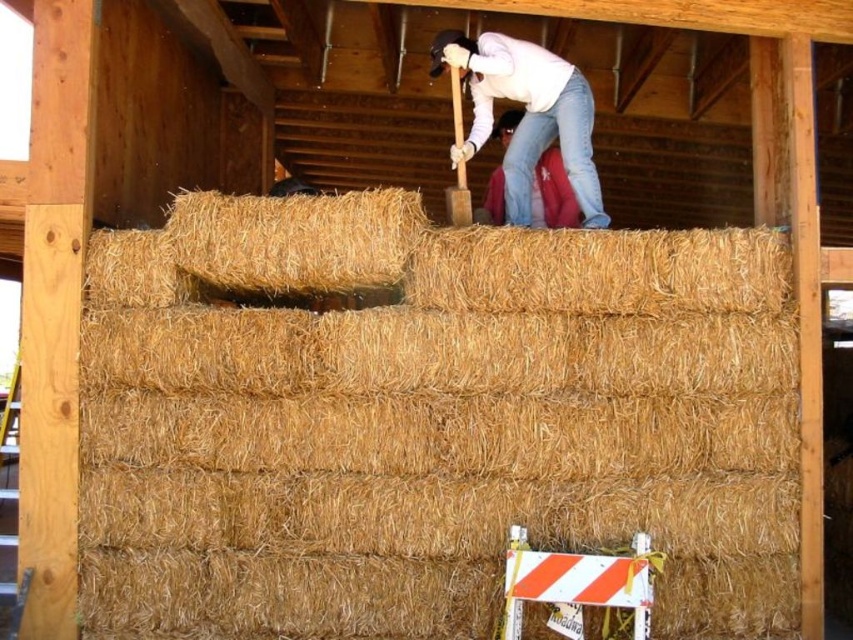
Which is behind, point (383, 230) or point (556, 147)?

The point (556, 147) is more distant.

Measure the distance from dry straw bale at upper center to jeans at upper center.

dry straw bale at upper center and jeans at upper center are 4.82 feet apart.

Identify the location of dry straw bale at upper center. (296, 240).

You are a GUI agent. You are given a task and a screenshot of the screen. Output one action in this format:
    pyautogui.click(x=<x>, y=<y>)
    Task: Click on the dry straw bale at upper center
    This screenshot has height=640, width=853.
    Given the screenshot: What is the action you would take?
    pyautogui.click(x=296, y=240)

Is point (173, 225) positioned behind point (450, 60)?

No.

The image size is (853, 640). I want to click on dry straw bale at upper center, so click(296, 240).

Locate an element on the screen. dry straw bale at upper center is located at coordinates (296, 240).

You are a GUI agent. You are given a task and a screenshot of the screen. Output one action in this format:
    pyautogui.click(x=<x>, y=<y>)
    Task: Click on the dry straw bale at upper center
    
    Given the screenshot: What is the action you would take?
    (296, 240)

What do you see at coordinates (526, 115) in the screenshot? Image resolution: width=853 pixels, height=640 pixels. I see `matte white shirt at upper center` at bounding box center [526, 115].

Is matte white shirt at upper center shorter than jeans at upper center?

No, matte white shirt at upper center is not shorter than jeans at upper center.

Measure the distance between point (518, 54) and camera.

Point (518, 54) and camera are 20.83 feet apart.

Image resolution: width=853 pixels, height=640 pixels. In order to click on matte white shirt at upper center in this screenshot , I will do `click(526, 115)`.